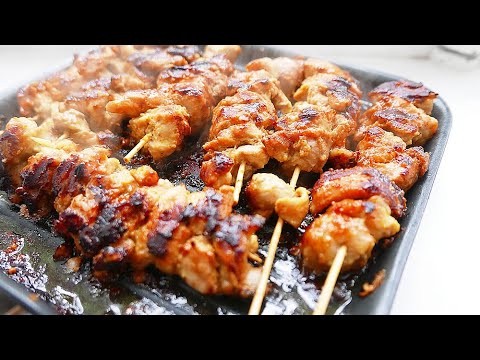
What are the coordinates of `lining of tray` in the screenshot? It's located at (36, 248), (191, 166), (287, 285).